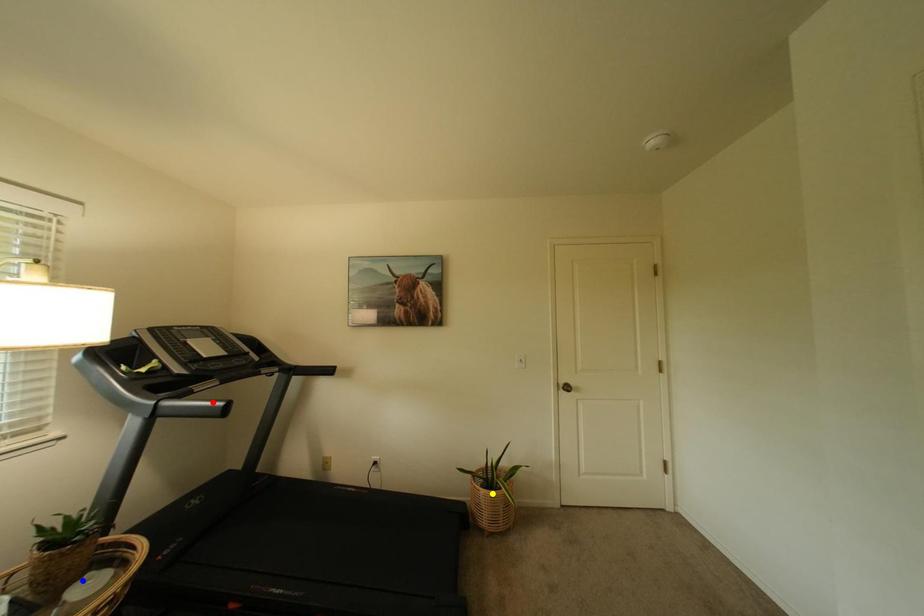
Order these from nearest to farthest:
blue point, red point, yellow point

blue point, red point, yellow point